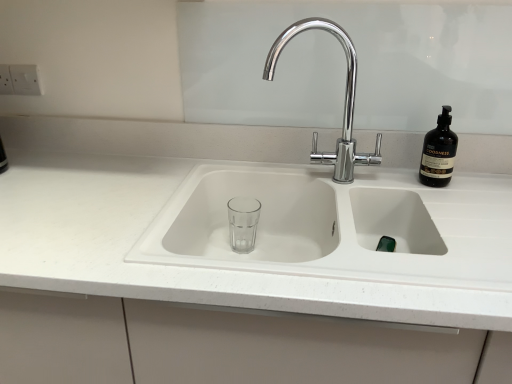
Where is `dark brown glass bottle at upper right`? The width and height of the screenshot is (512, 384). dark brown glass bottle at upper right is located at coordinates (439, 152).

Identify the location of dark brown glass bottle at upper right. pyautogui.click(x=439, y=152).

Can you confirm if dark brown glass bottle at upper right is taller than chrome/metallic faucet at center?

No, dark brown glass bottle at upper right is not taller than chrome/metallic faucet at center.

Is dark brown glass bottle at upper right outside of chrome/metallic faucet at center?

dark brown glass bottle at upper right is positioned outside chrome/metallic faucet at center.

Are dark brown glass bottle at upper right and chrome/metallic faucet at center far apart?

They are positioned close to each other.

From a real-world perspective, who is located higher, chrome/metallic faucet at center or white matte countertop at center?

chrome/metallic faucet at center.

Is chrome/metallic faucet at center in contact with white matte countertop at center?

chrome/metallic faucet at center and white matte countertop at center are clearly separated.

Which object is positioned more to the left, chrome/metallic faucet at center or white matte countertop at center?

white matte countertop at center.

Is chrome/metallic faucet at center oriented towards white matte countertop at center?

No.

From the image's perspective, does chrome/metallic faucet at center appear lower than dark brown glass bottle at upper right?

Actually, chrome/metallic faucet at center appears above dark brown glass bottle at upper right in the image.

Is chrome/metallic faucet at center not within dark brown glass bottle at upper right?

Yes.

At what (x,y) coordinates should I click in order to perform the action: click on bottle behind the chrome/metallic faucet at center. Please return your answer as a coordinate pair (x, y). The height and width of the screenshot is (384, 512). Looking at the image, I should click on (439, 152).

Considering the relative positions of chrome/metallic faucet at center and dark brown glass bottle at upper right in the image provided, is chrome/metallic faucet at center to the left of dark brown glass bottle at upper right from the viewer's perspective?

Indeed, chrome/metallic faucet at center is positioned on the left side of dark brown glass bottle at upper right.

What's the angular difference between white matte countertop at center and chrome/metallic faucet at center's facing directions?

They differ by 2.93 degrees in their facing directions.

From the image's perspective, which is above, white matte countertop at center or chrome/metallic faucet at center?

chrome/metallic faucet at center is shown above in the image.

Are white matte countertop at center and chrome/metallic faucet at center located far from each other?

They are positioned close to each other.

Considering the sizes of dark brown glass bottle at upper right and white matte countertop at center in the image, is dark brown glass bottle at upper right bigger or smaller than white matte countertop at center?

Considering their sizes, dark brown glass bottle at upper right takes up less space than white matte countertop at center.

Consider the image. From a real-world perspective, relative to white matte countertop at center, is dark brown glass bottle at upper right vertically above or below?

From a real-world perspective, dark brown glass bottle at upper right is physically above white matte countertop at center.

How much distance is there between dark brown glass bottle at upper right and white matte countertop at center?

They are 18.62 inches apart.

In terms of width, does white matte countertop at center look wider or thinner when compared to dark brown glass bottle at upper right?

white matte countertop at center is wider than dark brown glass bottle at upper right.

Does white matte countertop at center turn towards dark brown glass bottle at upper right?

No, white matte countertop at center is not turned towards dark brown glass bottle at upper right.

Is there a large distance between white matte countertop at center and dark brown glass bottle at upper right?

No, white matte countertop at center is in close proximity to dark brown glass bottle at upper right.

The width and height of the screenshot is (512, 384). What are the coordinates of `bottle to the right of white matte countertop at center` in the screenshot? It's located at (439, 152).

The image size is (512, 384). What are the coordinates of `bottle on the right of the chrome/metallic faucet at center` in the screenshot? It's located at (439, 152).

Locate an element on the screen. This screenshot has height=384, width=512. tap above the white matte countertop at center (from a real-world perspective) is located at coordinates (344, 101).

From the image, which object appears to be farther from dark brown glass bottle at upper right, chrome/metallic faucet at center or white matte countertop at center?

Among the two, white matte countertop at center is located further to dark brown glass bottle at upper right.

Considering their positions, is dark brown glass bottle at upper right positioned further to white matte countertop at center than chrome/metallic faucet at center?

dark brown glass bottle at upper right is further to white matte countertop at center.

When comparing their distances from white matte countertop at center, does chrome/metallic faucet at center or dark brown glass bottle at upper right seem further?

Among the two, dark brown glass bottle at upper right is located further to white matte countertop at center.

When comparing their distances from chrome/metallic faucet at center, does white matte countertop at center or dark brown glass bottle at upper right seem further?

white matte countertop at center is positioned further to the anchor chrome/metallic faucet at center.

From the image, which object appears to be farther from chrome/metallic faucet at center, dark brown glass bottle at upper right or white matte countertop at center?

white matte countertop at center lies further to chrome/metallic faucet at center than the other object.

Looking at this image, which object lies nearer to the anchor point dark brown glass bottle at upper right, white matte countertop at center or chrome/metallic faucet at center?

Among the two, chrome/metallic faucet at center is located nearer to dark brown glass bottle at upper right.

The image size is (512, 384). I want to click on bottle between chrome/metallic faucet at center and white matte countertop at center from top to bottom, so click(x=439, y=152).